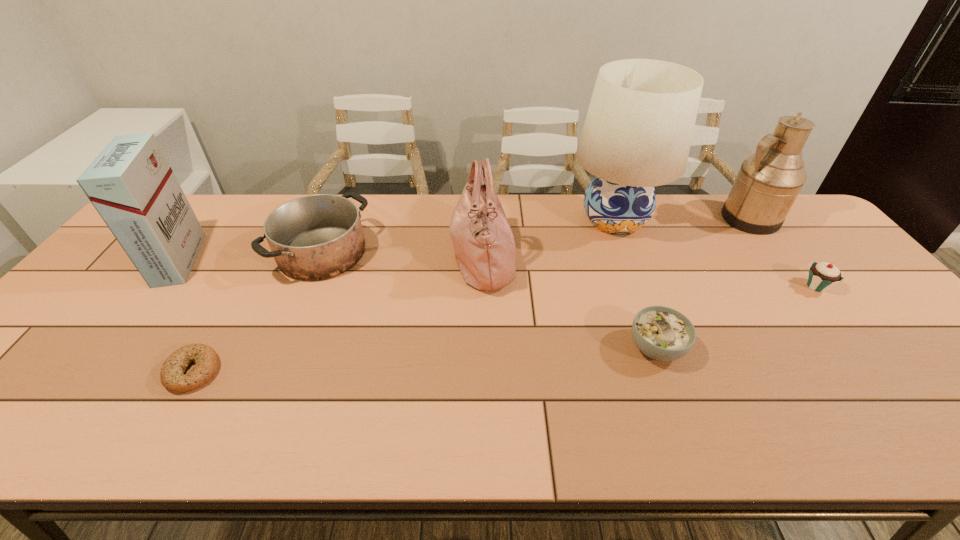
Locate an element on the screen. vacant space positioned 0.080m on the right of the cigarette case is located at coordinates (229, 260).

You are a GUI agent. You are given a task and a screenshot of the screen. Output one action in this format:
    pyautogui.click(x=<x>, y=<y>)
    Task: Click on the free region located at the front of the handbag with handles
    This screenshot has height=540, width=960.
    Given the screenshot: What is the action you would take?
    pyautogui.click(x=393, y=256)

Find the location of `vacant region located 0.400m at the front of the handbag with handles`. vacant region located 0.400m at the front of the handbag with handles is located at coordinates (315, 256).

This screenshot has height=540, width=960. I want to click on vacant area located 0.060m at the front of the handbag with handles, so click(430, 256).

Where is `vacant space located on the right of the saucepan`? Image resolution: width=960 pixels, height=540 pixels. vacant space located on the right of the saucepan is located at coordinates (456, 253).

The image size is (960, 540). I want to click on free spot located 0.160m on the back of the cupcake, so click(x=780, y=241).

Locate an element on the screen. vacant area situated on the left of the soup bowl is located at coordinates (481, 348).

I want to click on vacant point located on the left of the shortest object, so click(106, 372).

Locate an element on the screen. The image size is (960, 540). lampshade present at the far edge is located at coordinates (637, 134).

You are a GUI agent. You are given a task and a screenshot of the screen. Output one action in this format:
    pyautogui.click(x=<x>, y=<y>)
    Task: Click on the pitcher that is at the far edge
    
    Given the screenshot: What is the action you would take?
    pyautogui.click(x=768, y=182)